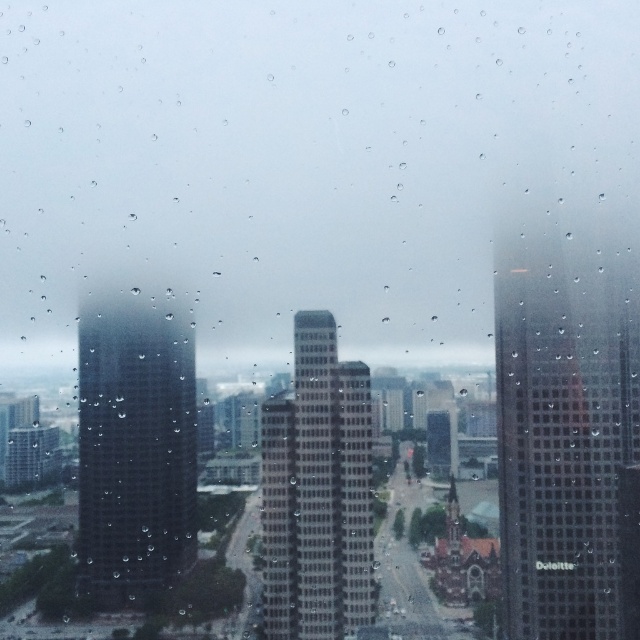
Question: Does matte glass skyscraper at left have a greater width compared to gray concrete skyscraper at center?

Choices:
 (A) yes
 (B) no

Answer: (A)

Question: Which object is the farthest from the gray concrete skyscraper at center?

Choices:
 (A) matte glass skyscraper at right
 (B) matte glass skyscraper at left

Answer: (A)

Question: Which object is farther from the camera taking this photo?

Choices:
 (A) gray concrete skyscraper at center
 (B) matte glass skyscraper at right
 (C) matte glass skyscraper at left

Answer: (B)

Question: Which point appears closest to the camera in this image?

Choices:
 (A) (326, 404)
 (B) (157, 477)

Answer: (A)

Question: In this image, where is matte glass skyscraper at right located relative to matte glass skyscraper at left?

Choices:
 (A) below
 (B) above

Answer: (B)

Question: Can you confirm if matte glass skyscraper at right is wider than matte glass skyscraper at left?

Choices:
 (A) no
 (B) yes

Answer: (B)